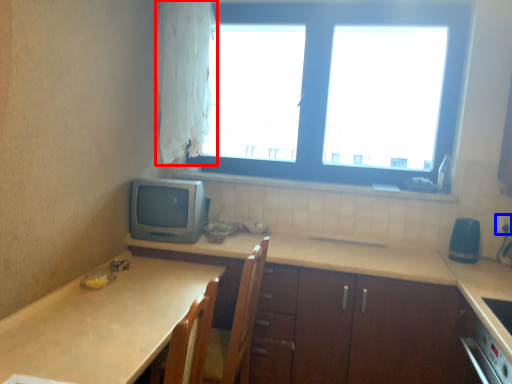
Question: Which object is closer to the camera taking this photo, curtain (highlighted by a red box) or electric outlet (highlighted by a blue box)?

Choices:
 (A) curtain
 (B) electric outlet

Answer: (A)